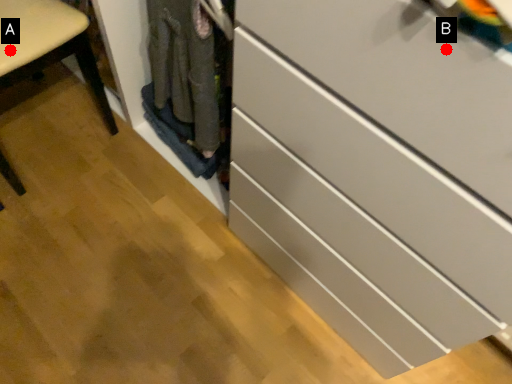
Question: Two points are circled on the image, labeled by A and B beside each circle. Which of the following is the farthest from the observer?

Choices:
 (A) A is further
 (B) B is further

Answer: (A)